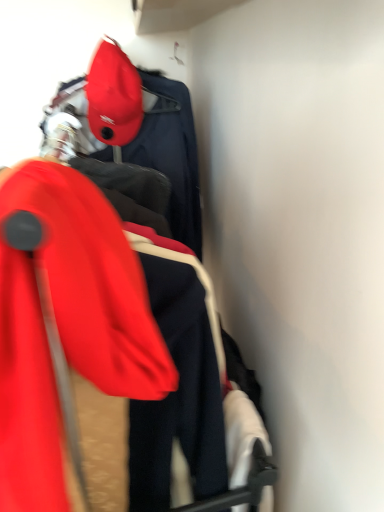
Question: From a real-world perspective, is matte red ski jacket at left over matte red cap at upper left?

Choices:
 (A) yes
 (B) no

Answer: (B)

Question: From a real-world perspective, does matte red ski jacket at left sit lower than matte red cap at upper left?

Choices:
 (A) no
 (B) yes

Answer: (B)

Question: Is matte red ski jacket at left to the right of matte red cap at upper left from the viewer's perspective?

Choices:
 (A) no
 (B) yes

Answer: (B)

Question: Is the surface of matte red ski jacket at left in direct contact with matte red cap at upper left?

Choices:
 (A) yes
 (B) no

Answer: (B)

Question: Is matte red cap at upper left at the back of matte red ski jacket at left?

Choices:
 (A) no
 (B) yes

Answer: (A)

Question: Does matte red ski jacket at left have a smaller size compared to matte red cap at upper left?

Choices:
 (A) no
 (B) yes

Answer: (A)

Question: Is matte red cap at upper left not inside matte red ski jacket at left?

Choices:
 (A) yes
 (B) no

Answer: (A)

Question: Can you confirm if matte red cap at upper left is positioned to the left of matte red ski jacket at left?

Choices:
 (A) no
 (B) yes

Answer: (B)

Question: Is matte red cap at upper left beside matte red ski jacket at left?

Choices:
 (A) no
 (B) yes

Answer: (A)

Question: Can you confirm if matte red cap at upper left is positioned to the right of matte red ski jacket at left?

Choices:
 (A) no
 (B) yes

Answer: (A)

Question: From a real-world perspective, is matte red cap at upper left positioned over matte red ski jacket at left based on gravity?

Choices:
 (A) yes
 (B) no

Answer: (A)

Question: Is matte red cap at upper left thinner than matte red ski jacket at left?

Choices:
 (A) no
 (B) yes

Answer: (B)

Question: Would you say matte red ski jacket at left is to the left or to the right of matte red cap at upper left in the picture?

Choices:
 (A) right
 (B) left

Answer: (A)